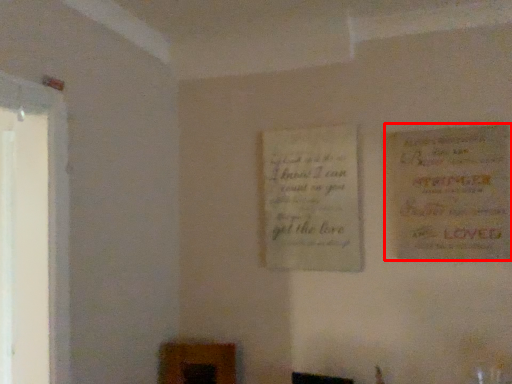
Question: In this image, where is poster (annotated by the red box) located relative to poster?

Choices:
 (A) left
 (B) right

Answer: (B)